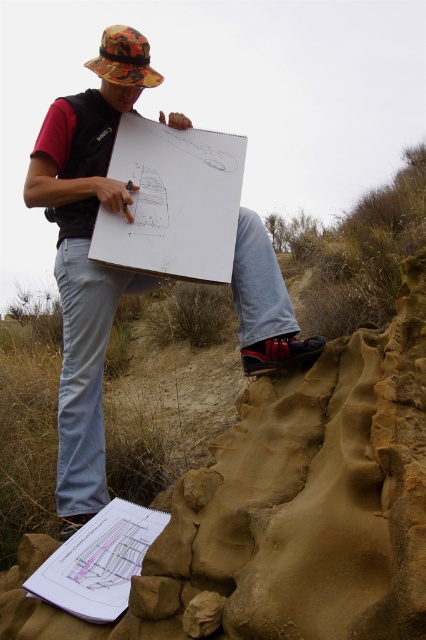
You are a photographer trying to capture the person in the scene. Which camouflage hat is closer to the camera, the camouflage hat at upper left or the camouflage fabric hat at upper center?

The camouflage hat at upper left is closer to the camera because it is in front of the camouflage fabric hat at upper center.

You are a photographer trying to capture the person in the scene. The camera you are using has a sensor that can only capture objects within a 0.5 unit radius from the center point. If you center your camera at point 0.5, 0.2, will the camouflage hat at upper left be captured in the photo?

The camouflage hat at upper left is located at point (83, 278). The distance between the center point (85, 320) and the hat is sqrt of squared differences in x and y coordinates. Calculating sqrt of squared difference in x is 0.064 squared which is 0.004096, and squared difference in y is 0.005 squared which is 0.000025. Adding them gives 0.004121, square root is approximately 0.064. Since 0.064 is less than 0.5 units, the hat will be captured.